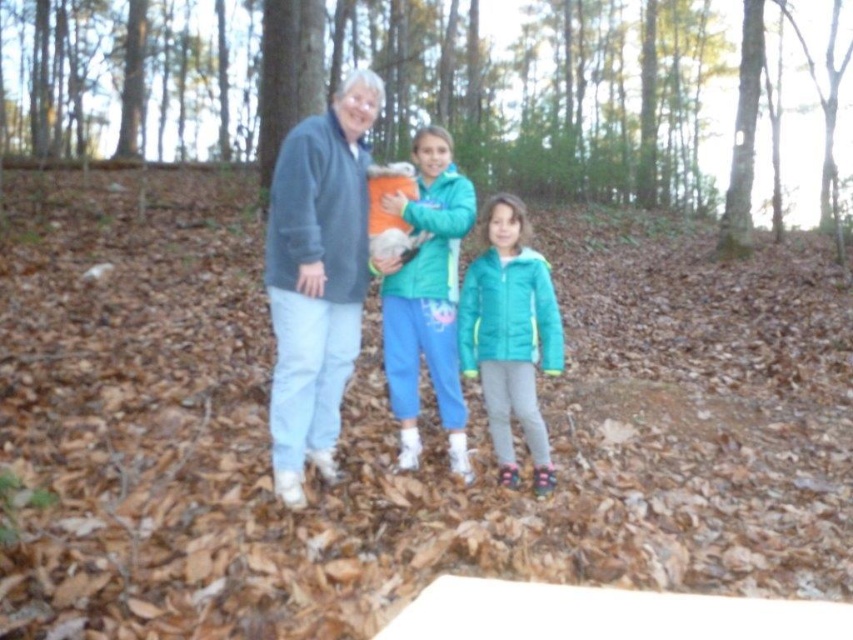
Question: Which of the following is the closest to the observer?

Choices:
 (A) (508, 195)
 (B) (689, 104)
 (C) (303, 289)

Answer: (C)

Question: Where is soft fleece jacket at center located in relation to teal quilted jacket at center in the image?

Choices:
 (A) right
 (B) left

Answer: (B)

Question: From the image, what is the correct spatial relationship of teal fleece jacket at center in relation to teal quilted jacket at center?

Choices:
 (A) below
 (B) above

Answer: (B)

Question: Which point is farther to the camera?

Choices:
 (A) (485, 260)
 (B) (462, 477)
 (C) (326, 141)
 (D) (585, 161)

Answer: (D)

Question: Which of the following is the closest to the observer?

Choices:
 (A) (509, 262)
 (B) (276, 458)
 (C) (154, 48)
 (D) (457, 412)

Answer: (B)

Question: Can you confirm if brown leaf litter at center is bigger than teal quilted jacket at center?

Choices:
 (A) yes
 (B) no

Answer: (A)